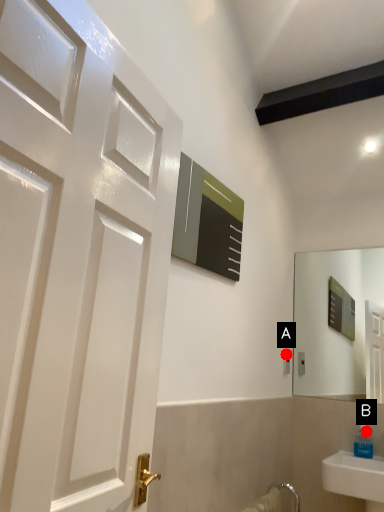
Question: Two points are circled on the image, labeled by A and B beside each circle. Which point is further to the camera?

Choices:
 (A) A is further
 (B) B is further

Answer: (A)